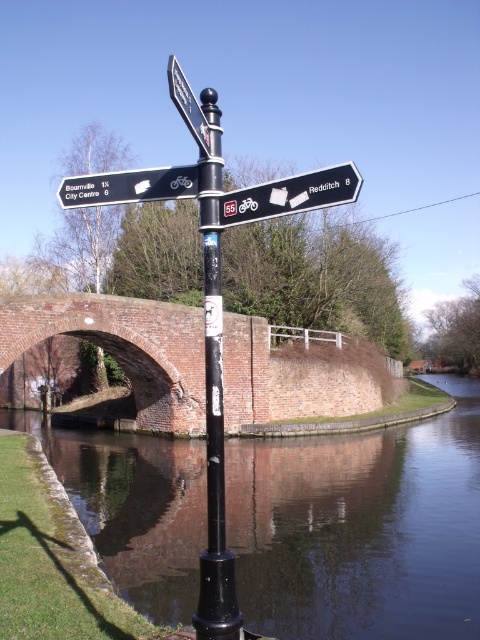
Which is more to the left, smooth concrete river at center or metallic silver sign at upper center?

metallic silver sign at upper center is more to the left.

Does smooth concrete river at center appear on the right side of metallic silver sign at upper center?

Yes, smooth concrete river at center is to the right of metallic silver sign at upper center.

Between point (430, 579) and point (171, 64), which one is positioned in front?

Point (430, 579) is in front.

This screenshot has width=480, height=640. What are the coordinates of `smooth concrete river at center` in the screenshot? It's located at (360, 529).

Can you confirm if smooth concrete river at center is positioned to the left of white plastic sign at upper right?

Indeed, smooth concrete river at center is positioned on the left side of white plastic sign at upper right.

Between smooth concrete river at center and white plastic sign at upper right, which one is positioned lower?

smooth concrete river at center

Does point (453, 381) come in front of point (312, 196)?

No.

The width and height of the screenshot is (480, 640). Find the location of `smooth concrete river at center`. smooth concrete river at center is located at coordinates (360, 529).

Is point (175, 499) positioned after point (190, 369)?

No.

Is point (297, 612) in front of point (284, 404)?

Yes, point (297, 612) is closer to viewer.

The image size is (480, 640). Find the location of `smooth concrete river at center`. smooth concrete river at center is located at coordinates (360, 529).

Where is `smooth concrete river at center`? smooth concrete river at center is located at coordinates (360, 529).